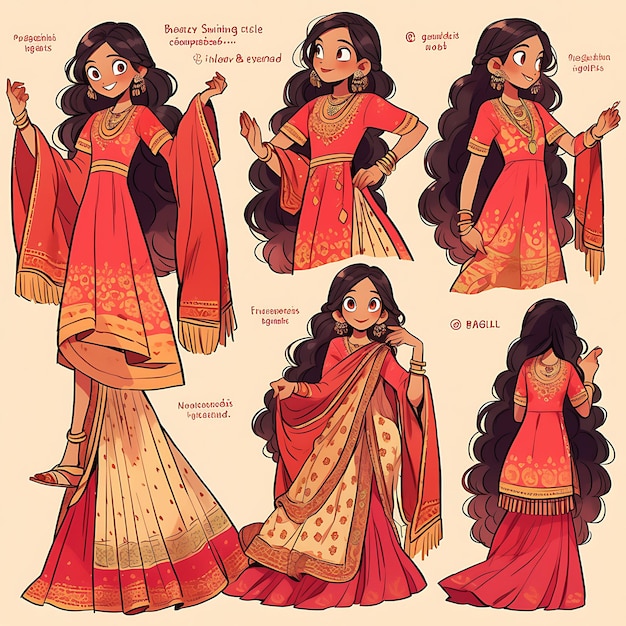
This screenshot has height=626, width=626. I want to click on tassles, so click(x=548, y=509), click(x=426, y=541), click(x=195, y=335), click(x=31, y=287), click(x=598, y=259).